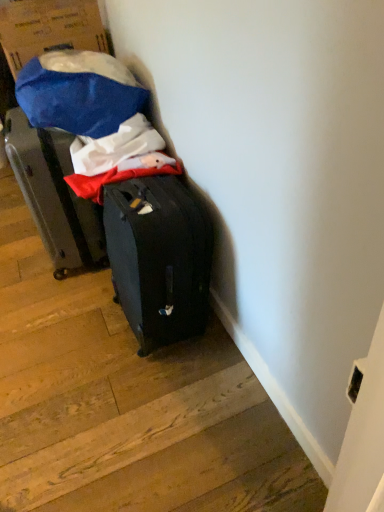
You are a GUI agent. You are given a task and a screenshot of the screen. Output one action in this format:
    pyautogui.click(x=<x>, y=<y>)
    Task: Click on the black hard suitcase at lower center
    
    Given the screenshot: What is the action you would take?
    pyautogui.click(x=126, y=403)

What do you see at coordinates (126, 403) in the screenshot? This screenshot has height=512, width=384. I see `black hard suitcase at lower center` at bounding box center [126, 403].

Find the location of a particular element. The image size is (384, 512). black hard suitcase at lower center is located at coordinates point(126,403).